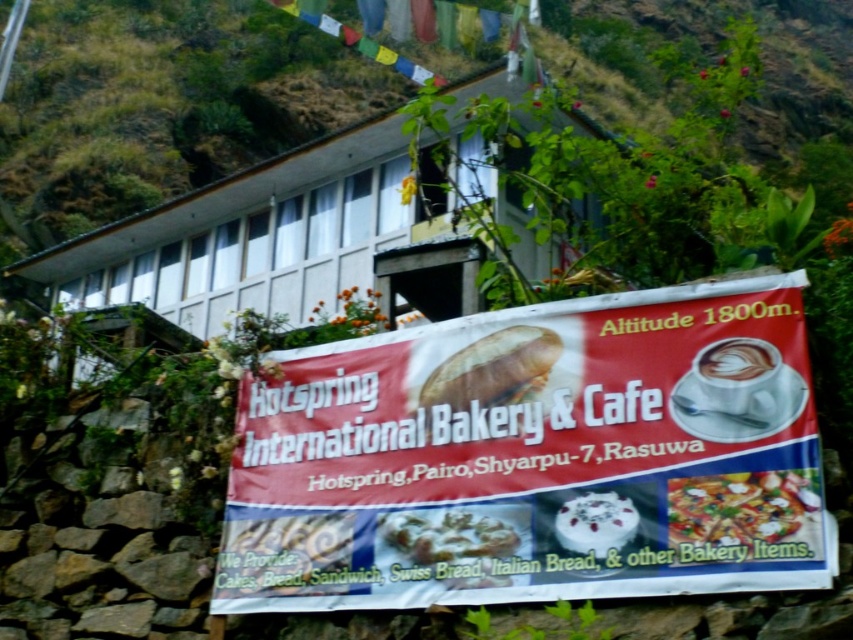
Question: Estimate the real-world distances between objects in this image. Which object is farther from the white frothy coffee at center?

Choices:
 (A) cappuccino foam at center
 (B) white frosted cake at center

Answer: (B)

Question: Which of the following is the closest to the observer?

Choices:
 (A) (514, 547)
 (B) (492, 400)
 (C) (647, 412)
 (D) (712, 371)

Answer: (A)

Question: In this image, where is matte white bread at center located relative to white frosted cake at center?

Choices:
 (A) right
 (B) left

Answer: (B)

Question: Can you confirm if matte white bread at center is wider than white matte swiss bread at center?

Choices:
 (A) yes
 (B) no

Answer: (A)

Question: Is white matte swiss bread at center above white frosted cake at center?

Choices:
 (A) no
 (B) yes

Answer: (A)

Question: Based on their relative distances, which object is nearer to the matte white bread at center?

Choices:
 (A) white frothy coffee at center
 (B) cappuccino foam at center
 (C) white matte swiss bread at center
 (D) white frosted cake at center

Answer: (C)